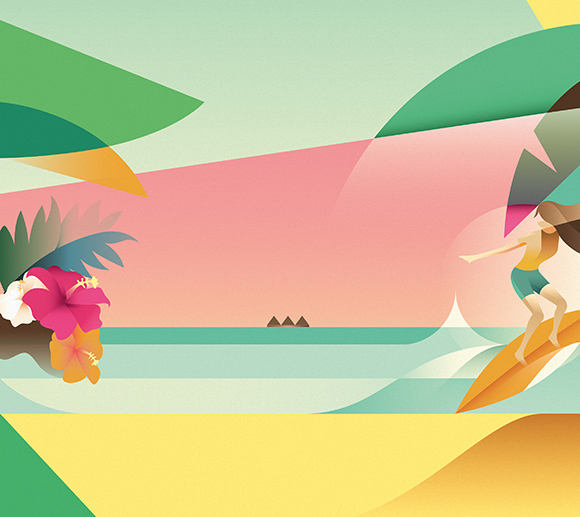
At what (x,y) coordinates should I click in order to perform the action: click on board. Please return your answer as a coordinate pair (x, y). Looking at the image, I should click on (503, 363).